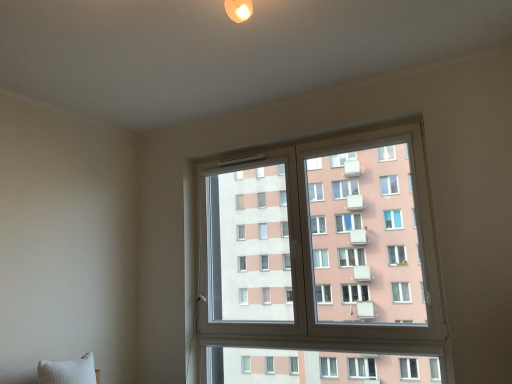
Question: Is white textured pillow at lower left looking in the opposite direction of transparent glass window at center?

Choices:
 (A) yes
 (B) no

Answer: (B)

Question: Is white textured pillow at lower left taller than transparent glass window at center?

Choices:
 (A) no
 (B) yes

Answer: (A)

Question: Would you say transparent glass window at center is part of white textured pillow at lower left's contents?

Choices:
 (A) yes
 (B) no

Answer: (B)

Question: Is the surface of white textured pillow at lower left in direct contact with transparent glass window at center?

Choices:
 (A) yes
 (B) no

Answer: (B)

Question: Is white textured pillow at lower left thinner than transparent glass window at center?

Choices:
 (A) yes
 (B) no

Answer: (B)

Question: Can you confirm if white textured pillow at lower left is positioned to the right of transparent glass window at center?

Choices:
 (A) no
 (B) yes

Answer: (A)

Question: Is transparent glass window at center taller than white textured pillow at lower left?

Choices:
 (A) yes
 (B) no

Answer: (A)

Question: From the image's perspective, does transparent glass window at center appear higher than white textured pillow at lower left?

Choices:
 (A) yes
 (B) no

Answer: (A)

Question: Considering the relative sizes of transparent glass window at center and white textured pillow at lower left in the image provided, is transparent glass window at center shorter than white textured pillow at lower left?

Choices:
 (A) no
 (B) yes

Answer: (A)

Question: From a real-world perspective, is transparent glass window at center physically above white textured pillow at lower left?

Choices:
 (A) yes
 (B) no

Answer: (A)

Question: Are transparent glass window at center and white textured pillow at lower left located far from each other?

Choices:
 (A) yes
 (B) no

Answer: (A)

Question: Does transparent glass window at center have a larger size compared to white textured pillow at lower left?

Choices:
 (A) no
 (B) yes

Answer: (B)

Question: Looking at their shapes, would you say transparent glass window at center is wider or thinner than white textured pillow at lower left?

Choices:
 (A) wide
 (B) thin

Answer: (B)